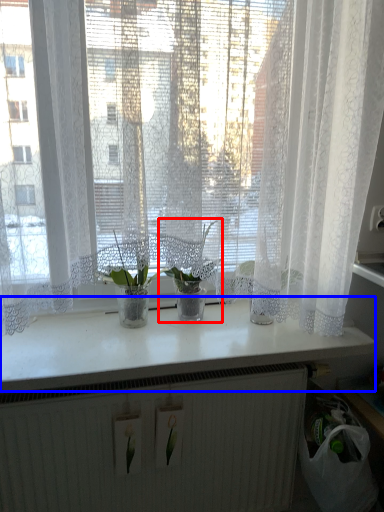
Question: Among these objects, which one is nearest to the camera, houseplant (highlighted by a red box) or counter top (highlighted by a blue box)?

Choices:
 (A) houseplant
 (B) counter top

Answer: (B)